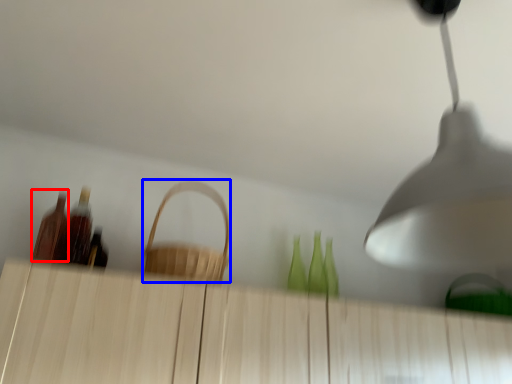
Question: Which object is further to the camera taking this photo, bottle (highlighted by a red box) or basket (highlighted by a blue box)?

Choices:
 (A) bottle
 (B) basket

Answer: (A)